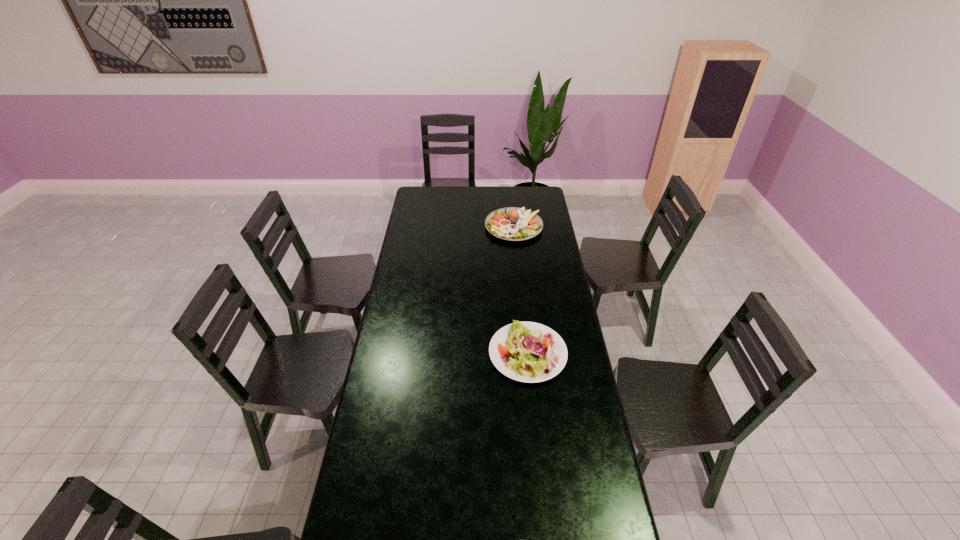
The width and height of the screenshot is (960, 540). Find the location of `free spot between the nearer salad plate and the farthest object`. free spot between the nearer salad plate and the farthest object is located at coordinates (520, 290).

You are a GUI agent. You are given a task and a screenshot of the screen. Output one action in this format:
    pyautogui.click(x=<x>, y=<y>)
    Task: Click on the vacant area that lies between the taller salad plate and the shorter salad plate
    This screenshot has width=960, height=540.
    Given the screenshot: What is the action you would take?
    pyautogui.click(x=520, y=290)

This screenshot has height=540, width=960. Find the location of `empty space that is in between the taller salad plate and the second shortest object`. empty space that is in between the taller salad plate and the second shortest object is located at coordinates (520, 290).

In order to click on free space between the tallest object and the nearer salad plate in this screenshot , I will do `click(520, 290)`.

Identify the location of free area in between the shorter salad plate and the tallest object. This screenshot has height=540, width=960. (520, 290).

This screenshot has height=540, width=960. Identify the location of free point between the second nearest object and the farthest object. (520, 290).

Identify the location of the closest object to the nearest object. This screenshot has width=960, height=540. (530, 352).

Identify which object is located as the second nearest to the plate. Please provide its 2D coordinates. Your answer should be formatted as a tuple, i.e. [(x, y)], where the tuple contains the x and y coordinates of a point satisfying the conditions above.

[(511, 223)]